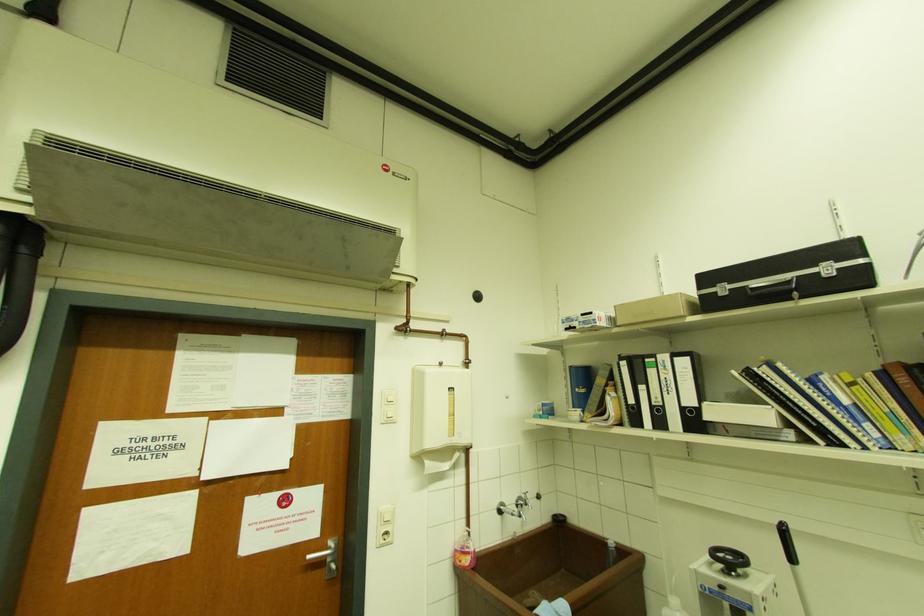
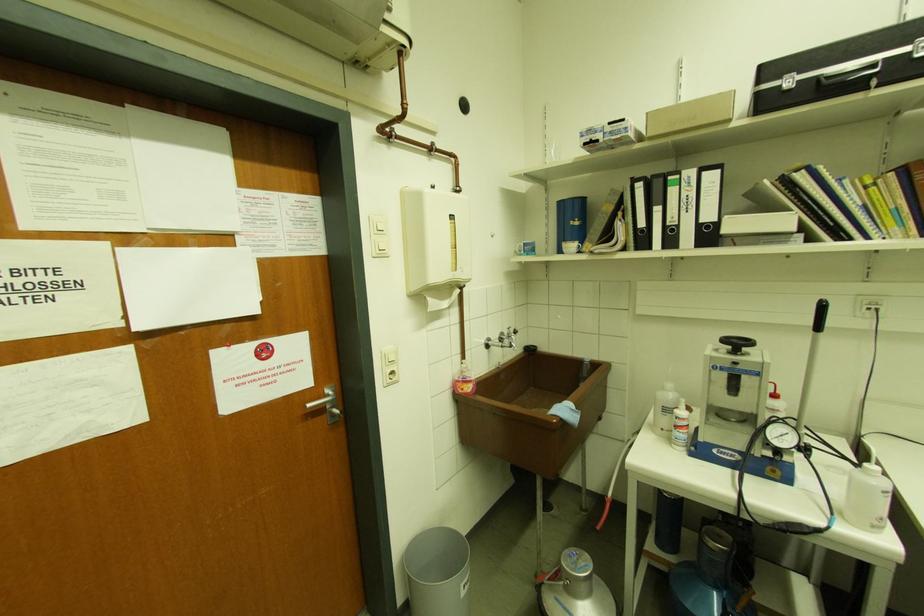
The point at (746,562) is marked in the first image. Where is the corresponding point in the second image?

(752, 344)